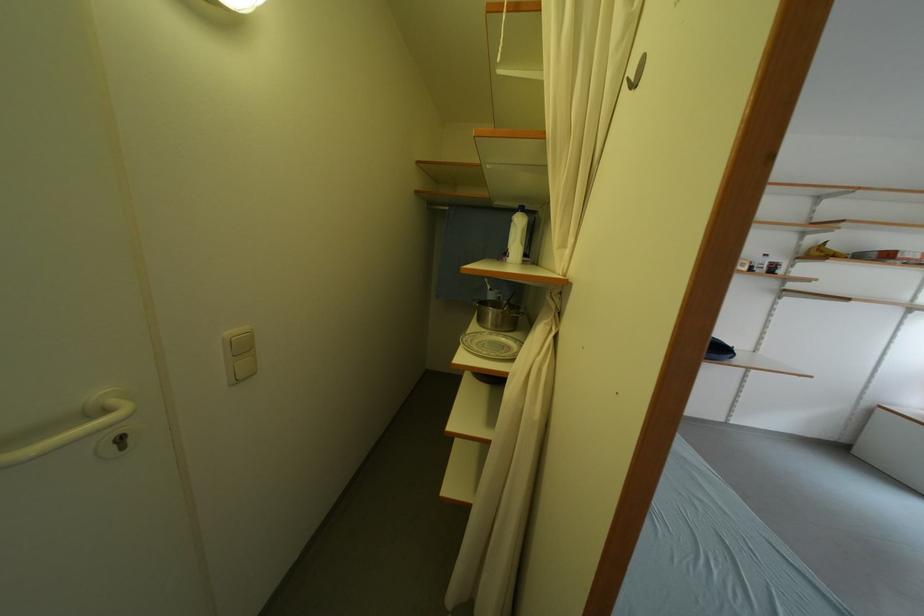
At what (x,y) coordinates should I click in order to perform the action: click on patterned ceramic plate. Please return your answer as a coordinate pair (x, y). Looking at the image, I should click on (491, 345).